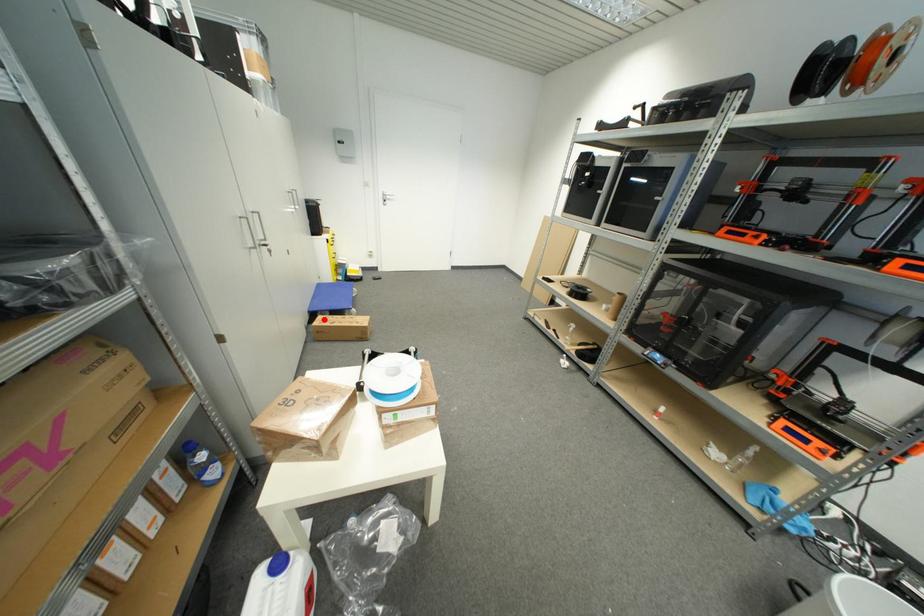
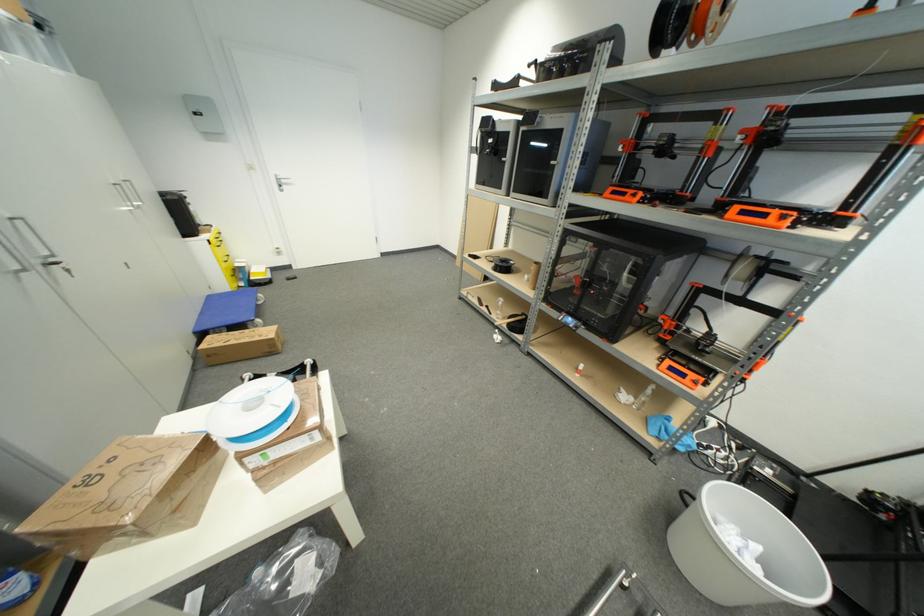
Find the pixel in the second image that matches the highlighted location in the first image.

(213, 339)